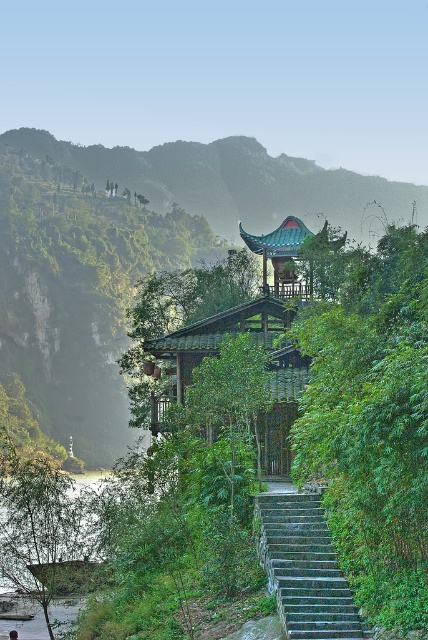
Question: Does green leafy bush at center appear on the left side of green leafy river at lower left?

Choices:
 (A) no
 (B) yes

Answer: (A)

Question: Where is green leafy bush at center located in relation to green leafy river at lower left in the image?

Choices:
 (A) right
 (B) left

Answer: (A)

Question: Estimate the real-world distances between objects in this image. Which object is closer to the stone steps at center?

Choices:
 (A) green leafy river at lower left
 (B) green wooden pavilion at upper center

Answer: (A)

Question: Which object appears closest to the camera in this image?

Choices:
 (A) green wooden pavilion at upper center
 (B) green leafy bush at center
 (C) stone steps at center
 (D) green leafy river at lower left

Answer: (B)

Question: Is green leafy river at lower left below stone steps at center?

Choices:
 (A) yes
 (B) no

Answer: (A)

Question: Which point is closer to the camera taking this photo?

Choices:
 (A) (401, 520)
 (B) (163, 150)

Answer: (A)